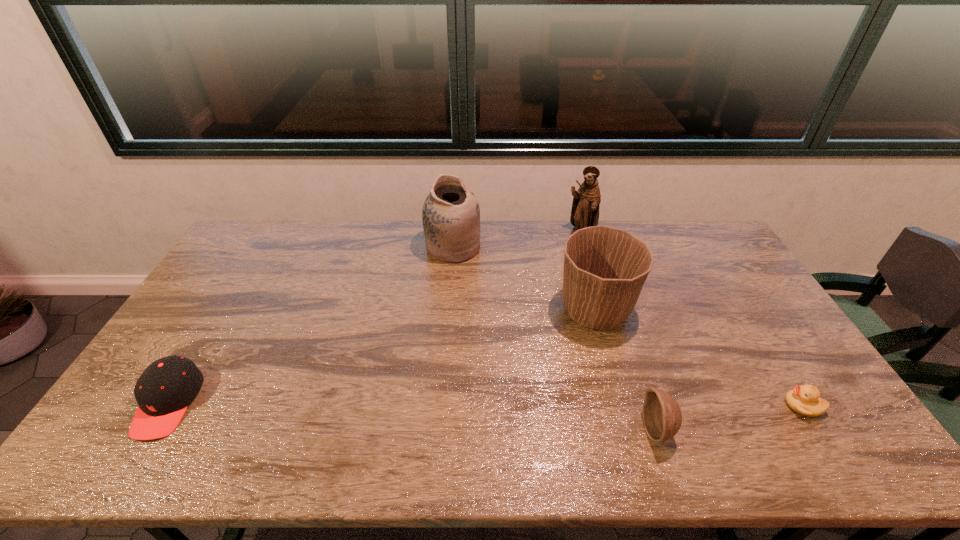
Locate an element on the screen. The image size is (960, 540). object situated at the right edge is located at coordinates (805, 400).

The image size is (960, 540). In order to click on object situated at the near left corner in this screenshot , I will do pos(164,390).

This screenshot has width=960, height=540. In the image, there is a desktop. Find the location of `blank space at the far edge`. blank space at the far edge is located at coordinates (372, 238).

This screenshot has width=960, height=540. I want to click on vacant space at the near edge of the desktop, so click(x=490, y=437).

The height and width of the screenshot is (540, 960). I want to click on vacant area at the left edge, so click(188, 329).

In the image, there is a desktop. In order to click on vacant space at the right edge in this screenshot , I will do `click(767, 322)`.

Locate an element on the screen. Image resolution: width=960 pixels, height=540 pixels. free region at the far left corner is located at coordinates (256, 238).

At what (x,y) coordinates should I click in order to perform the action: click on blank space at the far right corner of the desktop. Please return your answer as a coordinate pair (x, y). Looking at the image, I should click on (693, 239).

This screenshot has width=960, height=540. I want to click on free spot between the rightmost object and the fifth object from right to left, so click(628, 327).

Locate an element on the screen. The width and height of the screenshot is (960, 540). free area in between the second shortest object and the figurine is located at coordinates (374, 319).